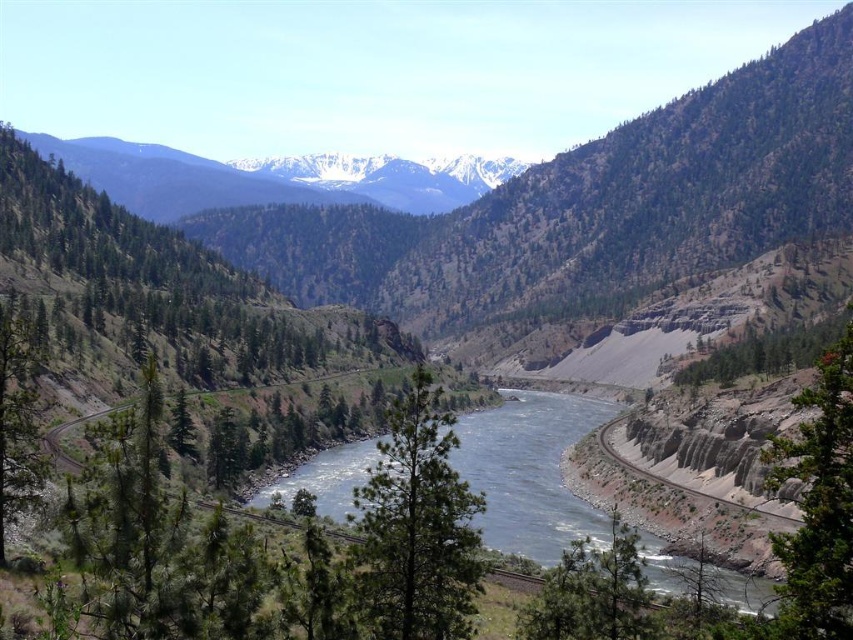
What do you see at coordinates (416, 528) in the screenshot? This screenshot has width=853, height=640. I see `green matte tree at center` at bounding box center [416, 528].

Looking at this image, measure the distance between green matte tree at center and snowy white mountain range at upper center.

green matte tree at center and snowy white mountain range at upper center are 607.94 meters apart.

Image resolution: width=853 pixels, height=640 pixels. In order to click on green matte tree at center in this screenshot , I will do `click(416, 528)`.

Is green matte tree at center bigger than green textured rock at right?

Incorrect, green matte tree at center is not larger than green textured rock at right.

Measure the distance between green matte tree at center and green textured rock at right.

A distance of 77.95 feet exists between green matte tree at center and green textured rock at right.

Describe the element at coordinates (416, 528) in the screenshot. I see `green matte tree at center` at that location.

This screenshot has height=640, width=853. I want to click on green matte tree at center, so click(x=416, y=528).

The height and width of the screenshot is (640, 853). What do you see at coordinates (817, 506) in the screenshot? I see `green textured rock at right` at bounding box center [817, 506].

Can you confirm if green textured rock at right is bigger than green textured tree at left?

Yes.

Locate an element on the screen. The width and height of the screenshot is (853, 640). green textured rock at right is located at coordinates (817, 506).